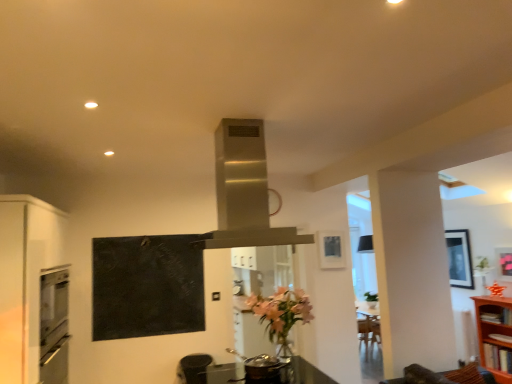
The height and width of the screenshot is (384, 512). I want to click on free space above black matte chalkboard at upper left (from a real-world perspective), so click(x=144, y=240).